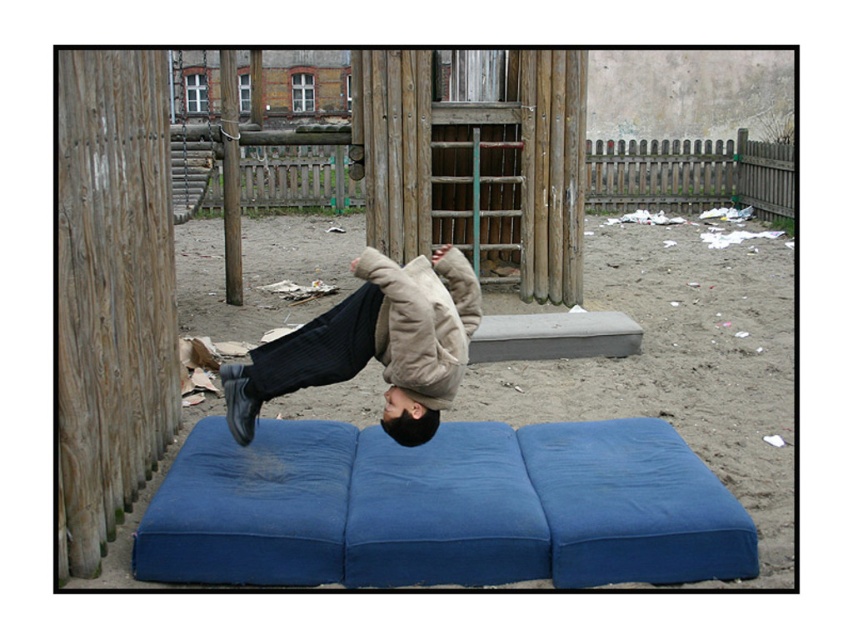
Is point (618, 301) in front of point (410, 355)?

That is False.

Between sandy brown sand at center and beige woolen jacket at center, which one is positioned lower?

beige woolen jacket at center is below.

This screenshot has height=640, width=853. What do you see at coordinates (679, 364) in the screenshot?
I see `sandy brown sand at center` at bounding box center [679, 364].

You are a GUI agent. You are given a task and a screenshot of the screen. Output one action in this format:
    pyautogui.click(x=<x>, y=<y>)
    Task: Click on the sandy brown sand at center
    
    Given the screenshot: What is the action you would take?
    pyautogui.click(x=679, y=364)

Is point (451, 307) closer to camera compared to point (215, 141)?

That is True.

Can you confirm if beige woolen jacket at center is positioned above brushed metal swing at upper center?

No, beige woolen jacket at center is not above brushed metal swing at upper center.

Who is more forward, (244, 435) or (175, 134)?

Point (244, 435) is more forward.

Identify the location of beige woolen jacket at center. (373, 344).

Can you confirm if sandy brown sand at center is positioned to the left of brushed metal swing at upper center?

In fact, sandy brown sand at center is to the right of brushed metal swing at upper center.

Is sandy brown sand at center further to the viewer compared to brushed metal swing at upper center?

No.

Where is `sandy brown sand at center`? This screenshot has width=853, height=640. sandy brown sand at center is located at coordinates (679, 364).

At what (x,y) coordinates should I click in order to perform the action: click on sandy brown sand at center. Please return your answer as a coordinate pair (x, y). The height and width of the screenshot is (640, 853). Looking at the image, I should click on (679, 364).